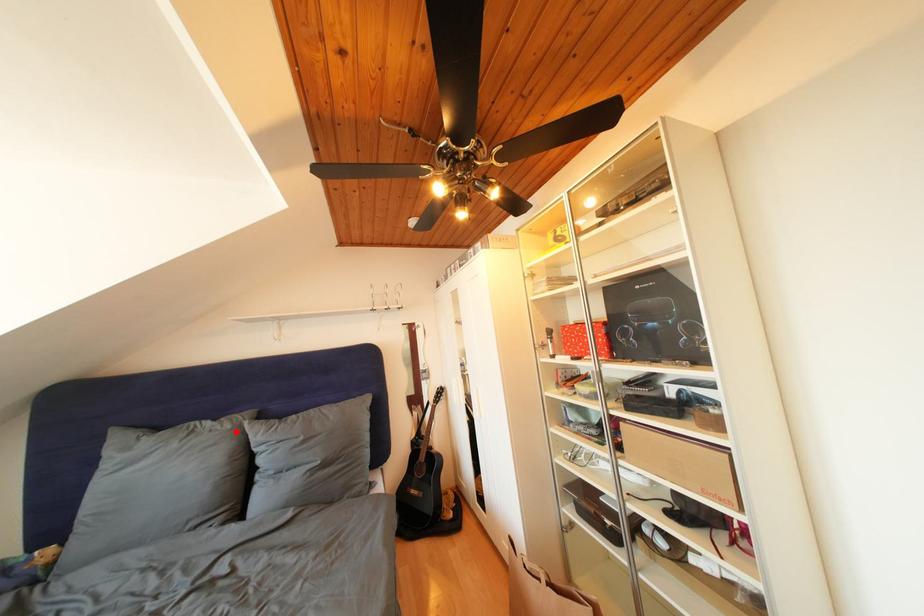
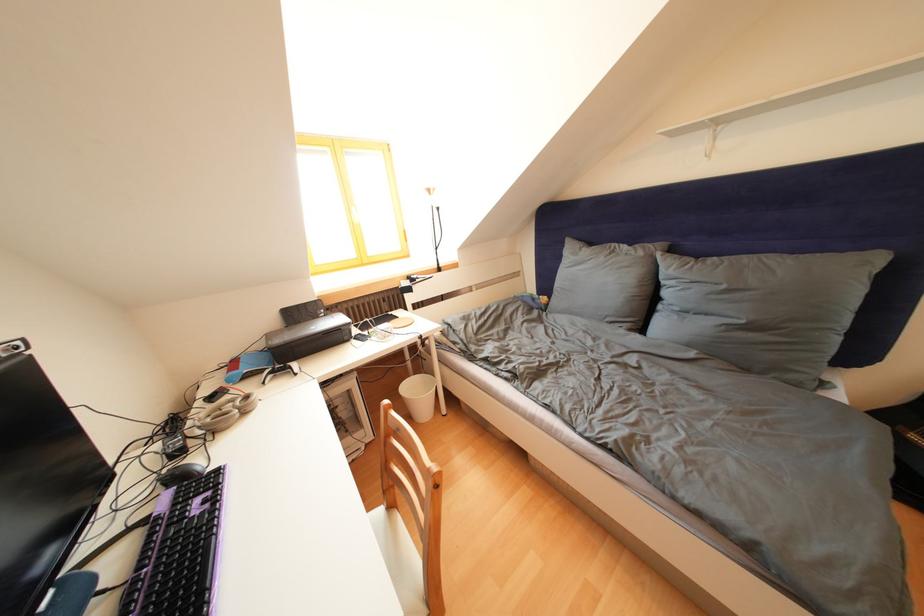
Locate, in the second image, the point that corresponds to the highlighted location in the first image.

(649, 259)